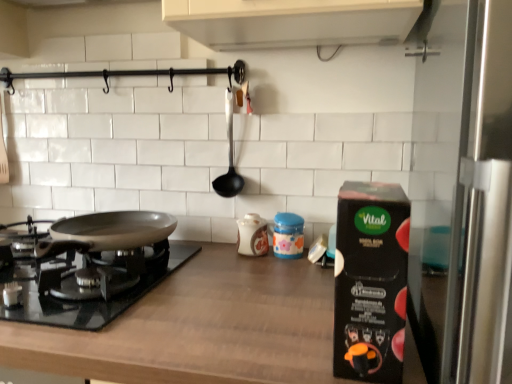
This screenshot has height=384, width=512. I want to click on free space that is in between matte ceramic jar at center, acting as the second kitchen appliance starting from the left, and black cardboard box at right, acting as the 3th kitchen appliance starting from the back, so click(307, 291).